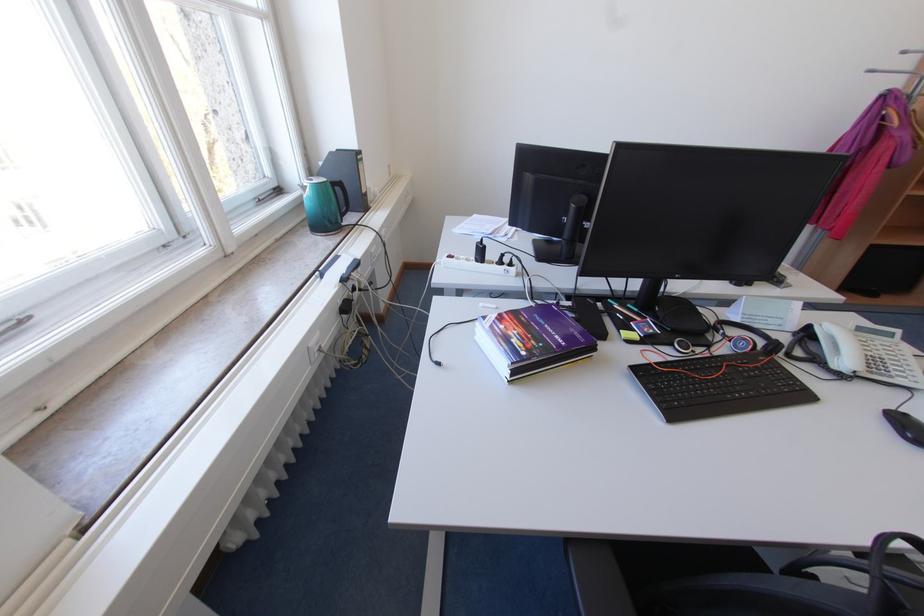
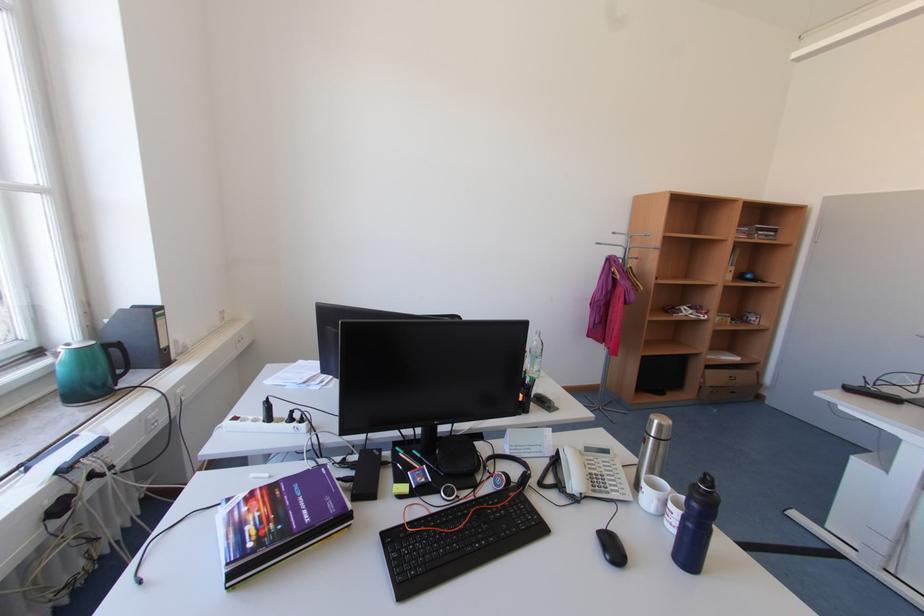
The first image is from the beginning of the video and the second image is from the end. How did the camera likely rotate when shooting the video?

The rotation direction of the camera is right-up.